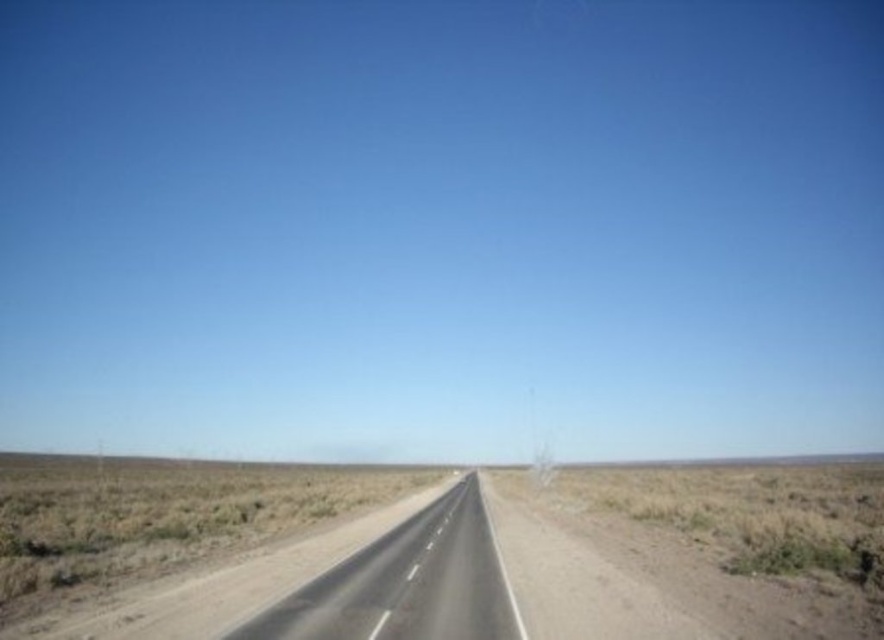
You are driving a car and see the smooth asphalt highway at center and the brown dirt at center. Which one is nearer to you?

The smooth asphalt highway at center is closer to the viewer than the brown dirt at center.

In the scene shown: You are driving a car with a width of 2 meters. The road has a no passing zone marked by white dashed lines. Can your car safely stay entirely on the smooth asphalt highway at center while avoiding the brown dirt at center?

The smooth asphalt highway at center is positioned on the right side of brown dirt at center. Since the highway is on the right side of the dirt, and the road is two lanes with a no passing zone, the car can safely stay entirely on the smooth asphalt highway at center by staying within the right lane, avoiding the brown dirt at center.